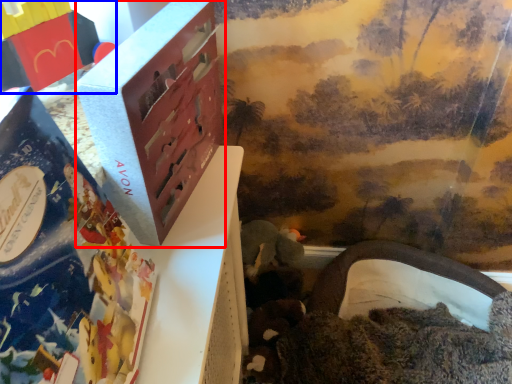
Question: Which object is closer to the camera taking this photo, box (highlighted by a red box) or toy (highlighted by a blue box)?

Choices:
 (A) box
 (B) toy

Answer: (A)